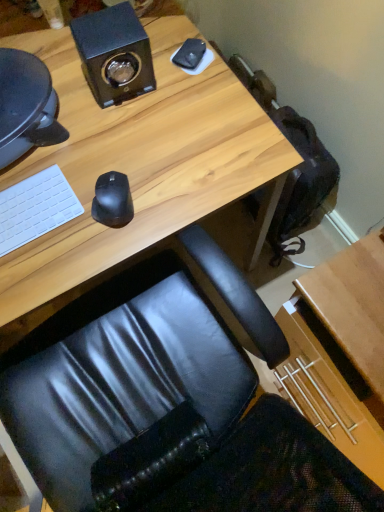
At what (x,y) coordinates should I click in order to perform the action: click on free space behind black matte speaker at upper left. Please return your answer as a coordinate pair (x, y). This screenshot has height=512, width=384. Looking at the image, I should click on (135, 16).